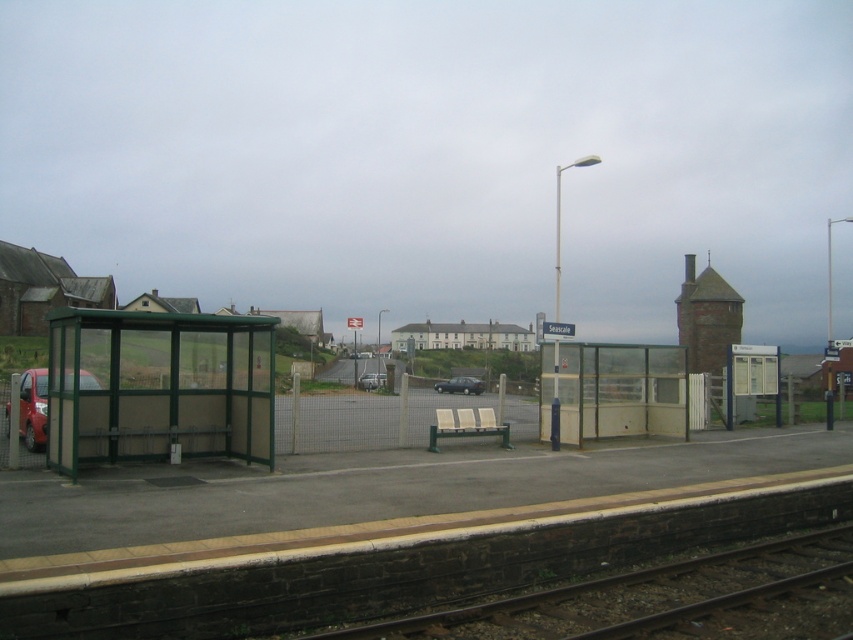
Question: Can you confirm if matte red car at left is positioned below matte black car at center?

Choices:
 (A) no
 (B) yes

Answer: (A)

Question: Which point is closer to the camera?

Choices:
 (A) (747, 586)
 (B) (30, 444)
 (C) (434, 387)

Answer: (A)

Question: Does matte black car at center have a greater width compared to silver metallic car at center?

Choices:
 (A) no
 (B) yes

Answer: (B)

Question: Can you confirm if green metallic bus stop at left is positioned below matte red car at left?

Choices:
 (A) yes
 (B) no

Answer: (A)

Question: Which point appears farthest from the camera in this image?

Choices:
 (A) (25, 388)
 (B) (834, 628)

Answer: (A)

Question: Among these points, which one is farthest from the camera?

Choices:
 (A) (453, 381)
 (B) (44, 376)
 (C) (372, 376)
 (D) (727, 605)

Answer: (C)